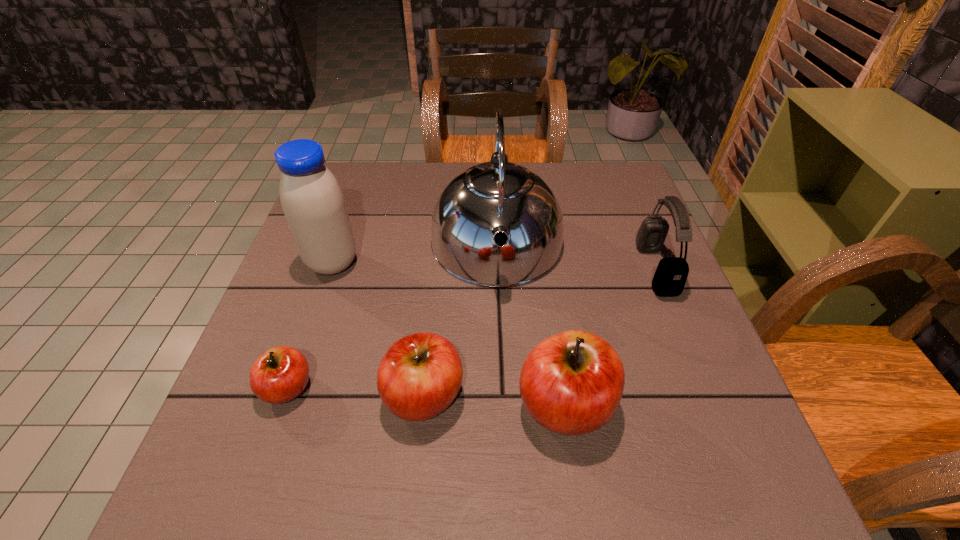
I want to click on free space that satisfies the following two spatial constraints: 1. on the front side of the soya milk; 2. on the right side of the second tallest apple, so click(x=286, y=396).

At what (x,y) coordinates should I click in order to perform the action: click on free spot that satisfies the following two spatial constraints: 1. on the headband of the headset; 2. on the front side of the rightmost apple. Please return your answer as a coordinate pair (x, y). Looking at the image, I should click on (710, 405).